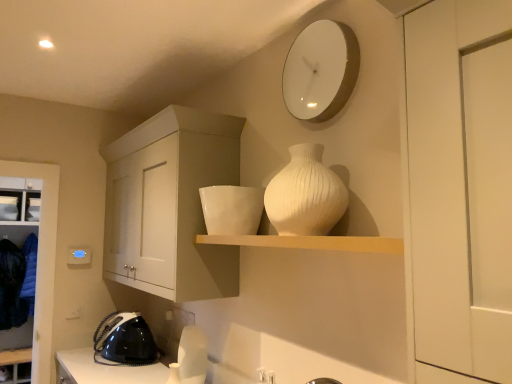
Question: Is white glossy clock at upper center smaller than dark blue fabric at lower left?

Choices:
 (A) yes
 (B) no

Answer: (A)

Question: From a real-world perspective, is white glossy clock at upper center over dark blue fabric at lower left?

Choices:
 (A) no
 (B) yes

Answer: (B)

Question: Is white glossy clock at upper center facing towards dark blue fabric at lower left?

Choices:
 (A) no
 (B) yes

Answer: (A)

Question: Is the depth of white glossy clock at upper center greater than that of dark blue fabric at lower left?

Choices:
 (A) yes
 (B) no

Answer: (B)

Question: Is white glossy clock at upper center at the left side of dark blue fabric at lower left?

Choices:
 (A) yes
 (B) no

Answer: (B)

Question: Does white glossy clock at upper center touch dark blue fabric at lower left?

Choices:
 (A) yes
 (B) no

Answer: (B)

Question: Considering the relative sizes of white matte cabinet at left, which is counted as the 1th cabinetry, starting from the left, and white glossy clock at upper center in the image provided, is white matte cabinet at left, which is counted as the 1th cabinetry, starting from the left, shorter than white glossy clock at upper center?

Choices:
 (A) no
 (B) yes

Answer: (A)

Question: Is the position of white matte cabinet at left, which is counted as the 1th cabinetry, starting from the left, more distant than that of white glossy clock at upper center?

Choices:
 (A) no
 (B) yes

Answer: (B)

Question: Is white matte cabinet at left, which is counted as the 1th cabinetry, starting from the left, at the right side of white glossy clock at upper center?

Choices:
 (A) no
 (B) yes

Answer: (A)

Question: Is white matte cabinet at left, which is counted as the 2th cabinetry, starting from the right, looking in the opposite direction of white glossy clock at upper center?

Choices:
 (A) no
 (B) yes

Answer: (A)

Question: Is white matte cabinet at left, the second cabinetry in the front-to-back sequence, taller than white glossy clock at upper center?

Choices:
 (A) yes
 (B) no

Answer: (A)

Question: Is white matte cabinet at left, which is counted as the 1th cabinetry, starting from the left, positioned before white glossy clock at upper center?

Choices:
 (A) no
 (B) yes

Answer: (A)

Question: Is black plastic iron at lower left, arranged as the second appliance when viewed from the left, further to the viewer compared to metallic silver iron at left, which is counted as the first appliance, starting from the left?

Choices:
 (A) no
 (B) yes

Answer: (A)